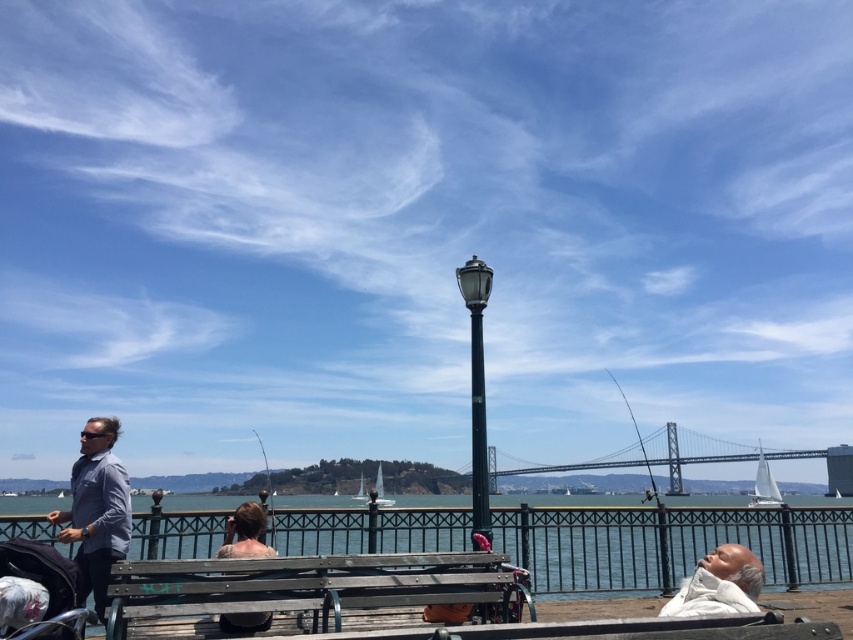
Question: Which of the following is the closest to the observer?

Choices:
 (A) (230, 624)
 (B) (219, 600)
 (C) (108, 445)

Answer: (B)

Question: Which point is farther to the camera?

Choices:
 (A) coord(136,557)
 (B) coord(247,529)
 (C) coord(71,492)
 (D) coord(27,572)

Answer: (A)

Question: Does wooden bench at center appear over white fabric baby carriage at lower left?

Choices:
 (A) no
 (B) yes

Answer: (B)

Question: Does clear blue water at lower center appear under white fabric baby carriage at lower left?

Choices:
 (A) yes
 (B) no

Answer: (A)

Question: Estimate the real-world distances between objects in this image. Which object is farther from the white fleece jacket at lower right?

Choices:
 (A) white fabric baby carriage at lower left
 (B) wooden bench at center

Answer: (A)

Question: Is clear blue water at lower center positioned before white fabric baby carriage at lower left?

Choices:
 (A) yes
 (B) no

Answer: (B)